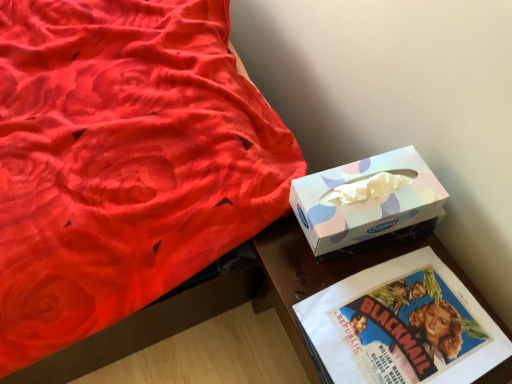
Question: Can you confirm if wooden glossy table at lower right is positioned to the right of velvet red bed at upper left?

Choices:
 (A) no
 (B) yes

Answer: (B)

Question: Is wooden glossy table at lower right at the left side of velvet red bed at upper left?

Choices:
 (A) yes
 (B) no

Answer: (B)

Question: Are wooden glossy table at lower right and velvet red bed at upper left beside each other?

Choices:
 (A) yes
 (B) no

Answer: (B)

Question: Is the depth of wooden glossy table at lower right less than that of velvet red bed at upper left?

Choices:
 (A) no
 (B) yes

Answer: (A)

Question: Is wooden glossy table at lower right further to camera compared to velvet red bed at upper left?

Choices:
 (A) yes
 (B) no

Answer: (A)

Question: Can you confirm if wooden glossy table at lower right is taller than velvet red bed at upper left?

Choices:
 (A) yes
 (B) no

Answer: (B)

Question: Can you confirm if wooden glossy table at lower right is positioned to the right of pastel paper tissue box at right?

Choices:
 (A) yes
 (B) no

Answer: (A)

Question: Can we say wooden glossy table at lower right lies outside pastel paper tissue box at right?

Choices:
 (A) no
 (B) yes

Answer: (B)

Question: From a real-world perspective, is wooden glossy table at lower right positioned over pastel paper tissue box at right based on gravity?

Choices:
 (A) yes
 (B) no

Answer: (B)

Question: From the image's perspective, does wooden glossy table at lower right appear lower than pastel paper tissue box at right?

Choices:
 (A) no
 (B) yes

Answer: (B)

Question: Is wooden glossy table at lower right wider than pastel paper tissue box at right?

Choices:
 (A) yes
 (B) no

Answer: (A)

Question: Is wooden glossy table at lower right with pastel paper tissue box at right?

Choices:
 (A) yes
 (B) no

Answer: (B)

Question: From a real-world perspective, is velvet red bed at upper left below wooden glossy table at lower right?

Choices:
 (A) no
 (B) yes

Answer: (B)